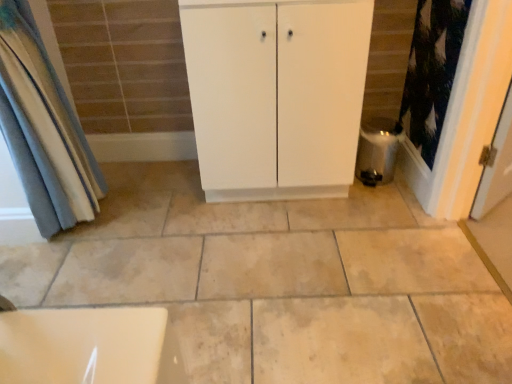
Question: Considering the relative sizes of white matte cabinet at center and satin silver water heater at lower right in the image provided, is white matte cabinet at center smaller than satin silver water heater at lower right?

Choices:
 (A) no
 (B) yes

Answer: (A)

Question: Is white matte cabinet at center completely or partially outside of satin silver water heater at lower right?

Choices:
 (A) yes
 (B) no

Answer: (A)

Question: Is white matte cabinet at center turned away from satin silver water heater at lower right?

Choices:
 (A) no
 (B) yes

Answer: (A)

Question: Considering the relative positions of white matte cabinet at center and satin silver water heater at lower right in the image provided, is white matte cabinet at center in front of satin silver water heater at lower right?

Choices:
 (A) yes
 (B) no

Answer: (A)

Question: From a real-world perspective, is white matte cabinet at center beneath satin silver water heater at lower right?

Choices:
 (A) yes
 (B) no

Answer: (B)

Question: In terms of height, does white matte cabinet at center look taller or shorter compared to blue fabric curtain at left?

Choices:
 (A) tall
 (B) short

Answer: (B)

Question: Choose the correct answer: Is white matte cabinet at center inside blue fabric curtain at left or outside it?

Choices:
 (A) outside
 (B) inside

Answer: (A)

Question: Considering the relative positions of white matte cabinet at center and blue fabric curtain at left in the image provided, is white matte cabinet at center to the left or to the right of blue fabric curtain at left?

Choices:
 (A) left
 (B) right

Answer: (B)

Question: Looking at the image, does white matte cabinet at center seem bigger or smaller compared to blue fabric curtain at left?

Choices:
 (A) big
 (B) small

Answer: (A)

Question: Is white matte cabinet at center to the left or to the right of satin silver water heater at lower right in the image?

Choices:
 (A) left
 (B) right

Answer: (A)

Question: In terms of width, does white matte cabinet at center look wider or thinner when compared to satin silver water heater at lower right?

Choices:
 (A) thin
 (B) wide

Answer: (B)

Question: In terms of size, does white matte cabinet at center appear bigger or smaller than satin silver water heater at lower right?

Choices:
 (A) big
 (B) small

Answer: (A)

Question: Considering their positions, is white matte cabinet at center located in front of or behind satin silver water heater at lower right?

Choices:
 (A) behind
 (B) front

Answer: (B)

Question: Based on their sizes in the image, would you say blue fabric curtain at left is bigger or smaller than white matte cabinet at center?

Choices:
 (A) big
 (B) small

Answer: (B)

Question: From the image's perspective, is blue fabric curtain at left positioned above or below white matte cabinet at center?

Choices:
 (A) below
 (B) above

Answer: (A)